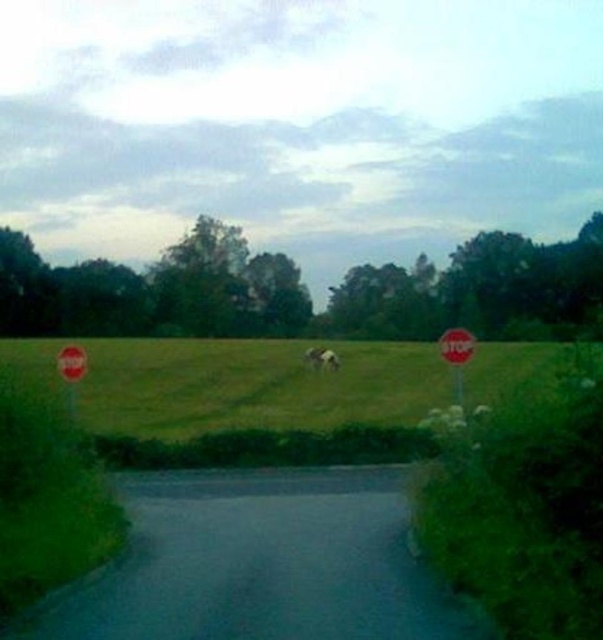
You are driving a car and see the red plastic stop sign at left. Can you estimate its location in the image using coordinates?

The red plastic stop sign at left is located at coordinates point (71, 362).

You are standing at the edge of the road in the rural scene. You notice the green grass at center and the white fluffy cloud at center. Which of these two objects appears bigger in the image?

The green grass at center appears larger in size than the white fluffy cloud at center in the image.

You are driving a car and see both the white paper stop sign at right and the red plastic stop sign at left along the roadside. Which stop sign should you approach first as you drive along the road?

You should approach the red plastic stop sign at left first because it is positioned to the left of the white paper stop sign at right, meaning it comes earlier along your driving path.